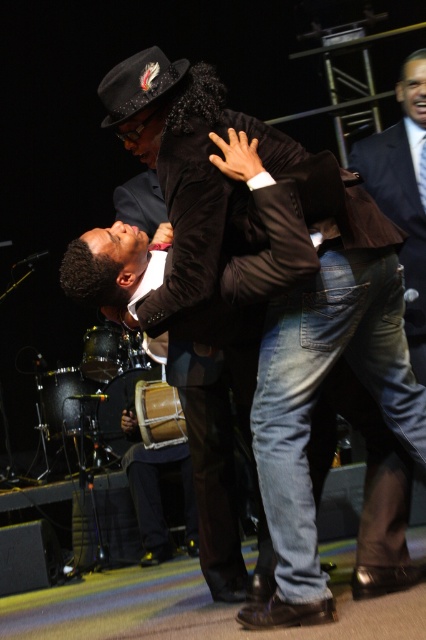
You are a photographer setting up for a group photo. You need to position the black leather jacket at center and the dark brown suit at upper right in such a way that both can fit comfortably in the frame. Considering their sizes, which object might require more space horizontally?

The black leather jacket at center might require more space horizontally since it is wider than the dark brown suit at upper right.